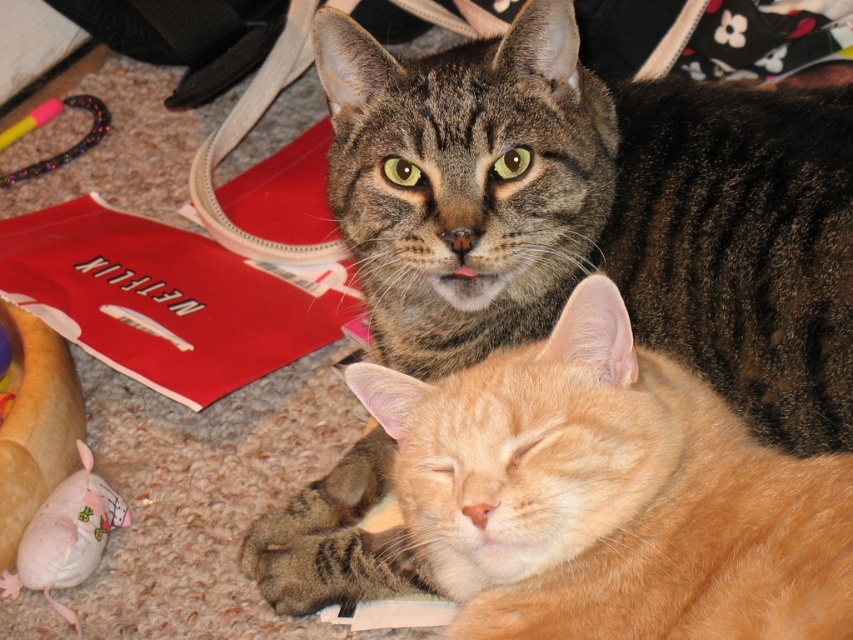
Question: Does tabby fur cat at upper center come in front of pink fabric mouse at lower left?

Choices:
 (A) no
 (B) yes

Answer: (B)

Question: In this image, where is tabby fur cat at upper center located relative to pink fabric mouse at lower left?

Choices:
 (A) below
 (B) above

Answer: (B)

Question: Can you confirm if tabby fur cat at upper center is positioned below pink fabric mouse at lower left?

Choices:
 (A) no
 (B) yes

Answer: (A)

Question: Which point is closer to the camera?

Choices:
 (A) pink fabric mouse at lower left
 (B) tabby fur cat at upper center

Answer: (B)

Question: Which point appears farthest from the camera in this image?

Choices:
 (A) (22, 556)
 (B) (807, 307)

Answer: (A)

Question: Which point is closer to the camera?

Choices:
 (A) (798, 385)
 (B) (77, 584)

Answer: (A)